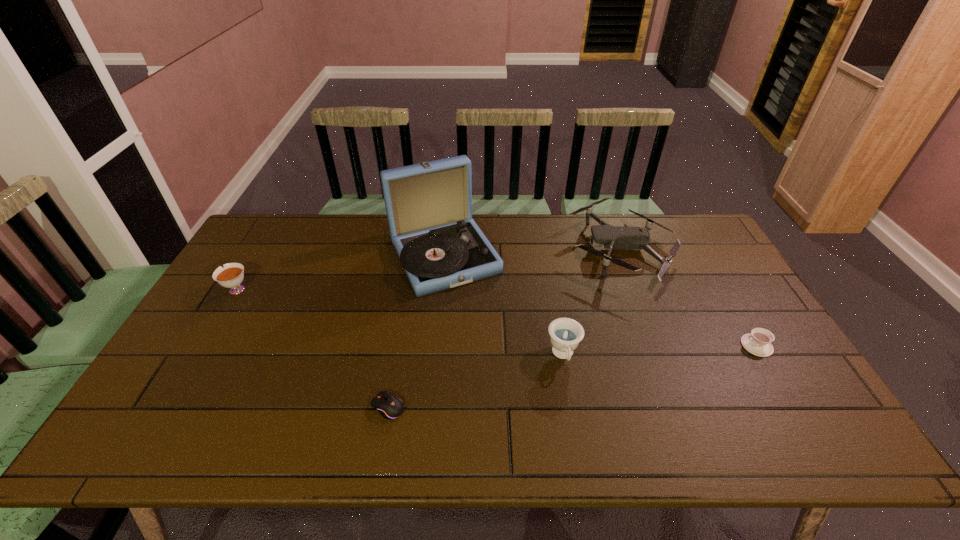
Where is `the tallest object`? the tallest object is located at coordinates (429, 205).

Locate an element on the screen. Image resolution: width=960 pixels, height=540 pixels. drone is located at coordinates coord(611,237).

Find the location of `the fourth object from left to right`. the fourth object from left to right is located at coordinates (565, 334).

You are a GUI agent. You are given a task and a screenshot of the screen. Output one action in this format:
    pyautogui.click(x=<x>, y=<y>)
    Task: Click on the leftmost teacup
    
    Given the screenshot: What is the action you would take?
    pyautogui.click(x=231, y=276)

I want to click on the leftmost object, so click(x=231, y=276).

Identify the location of the shortest teacup. This screenshot has height=540, width=960. (758, 342).

This screenshot has height=540, width=960. I want to click on the rightmost teacup, so click(x=758, y=342).

Where is `computer mouse`? The width and height of the screenshot is (960, 540). computer mouse is located at coordinates click(x=389, y=406).

The width and height of the screenshot is (960, 540). Find the location of `the shortest object`. the shortest object is located at coordinates (389, 406).

This screenshot has width=960, height=540. In order to click on blank area located 0.240m on the left of the tallest object in this screenshot , I will do `click(315, 256)`.